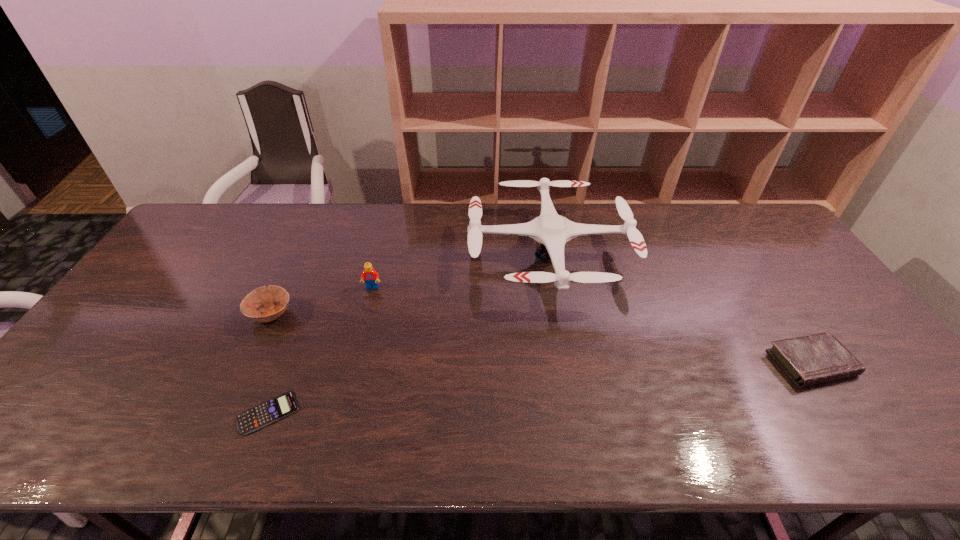
In the image, there is a desktop. At what (x,y) coordinates should I click in order to perform the action: click on free space at the near left corner. Please return your answer as a coordinate pair (x, y). Looking at the image, I should click on (33, 441).

What are the coordinates of `empty space between the drone and the fourth tallest object` in the screenshot? It's located at (680, 309).

At what (x,y) coordinates should I click in order to perform the action: click on free space between the drone and the third object from right to left. Please return your answer as a coordinate pair (x, y). Looking at the image, I should click on (461, 271).

Where is `free spot between the tallest object and the shortest object`? The height and width of the screenshot is (540, 960). free spot between the tallest object and the shortest object is located at coordinates (409, 333).

What are the coordinates of `unoccupied position between the fourth object from left to right and the calculator` in the screenshot? It's located at (409, 333).

This screenshot has height=540, width=960. What are the coordinates of `free space between the tallest object and the second tallest object` in the screenshot? It's located at (461, 271).

The image size is (960, 540). What are the coordinates of `free space that is in between the nearest object and the rightmost object` in the screenshot? It's located at (540, 388).

Find the location of a particular element. free spot between the second nearest object and the third tallest object is located at coordinates (541, 339).

Locate an element on the screen. This screenshot has height=540, width=960. empty space between the second shortest object and the shortest object is located at coordinates (540, 388).

Locate an element on the screen. vacant space that's between the diary and the third tallest object is located at coordinates (541, 339).